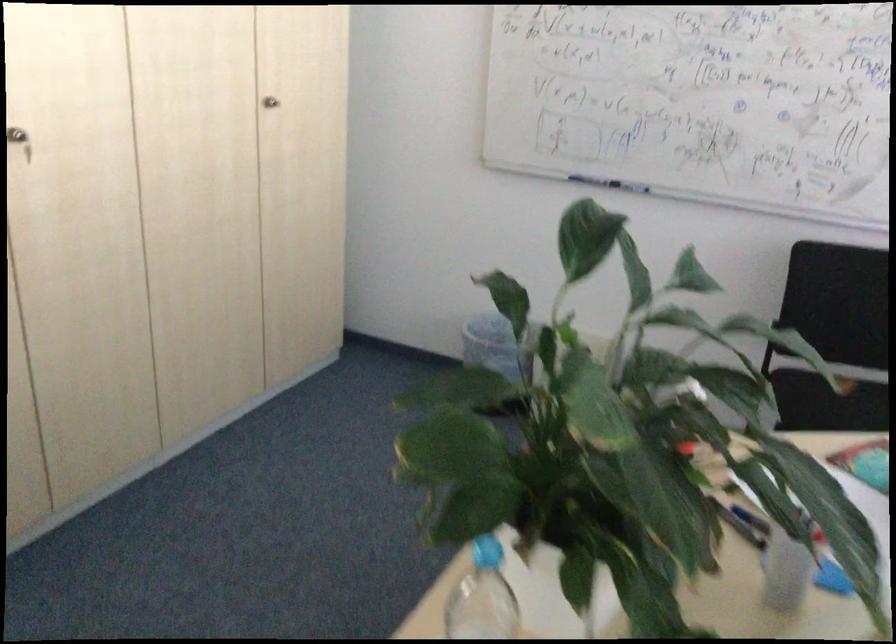
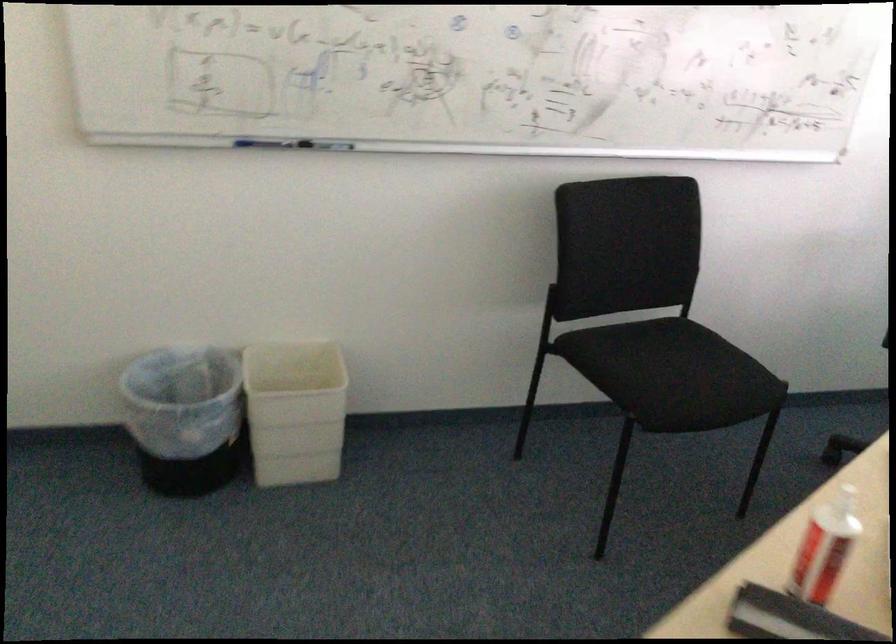
The point at (479,352) is marked in the first image. Where is the corresponding point in the second image?

(185, 417)